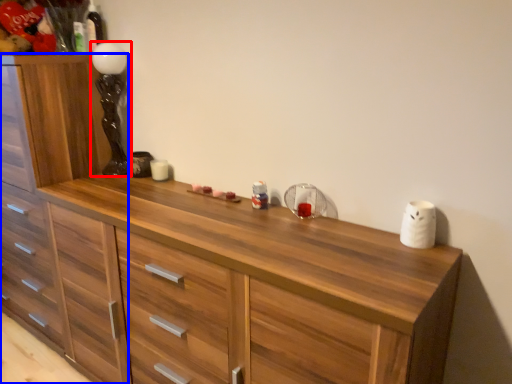
Question: Which object is closer to the camera taking this photo, lamp (highlighted by a red box) or chest of drawers (highlighted by a blue box)?

Choices:
 (A) lamp
 (B) chest of drawers

Answer: (B)